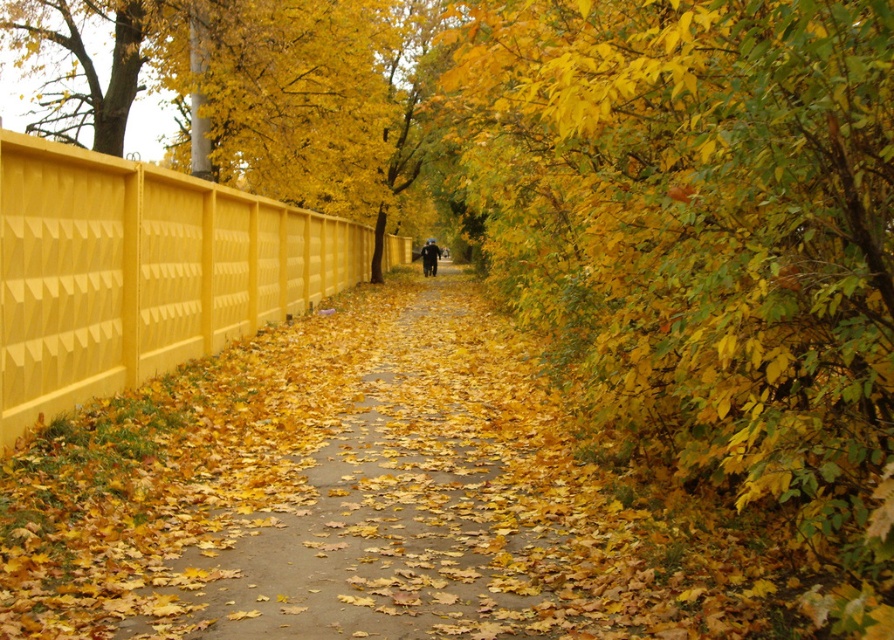
You are standing on the yellow concrete pavement at center and want to see over the matte yellow fence at left to check the weather. Can you see over the fence from your current position?

The yellow concrete pavement at center has a lesser height compared to matte yellow fence at left, so you cannot see over the matte yellow fence at left from your current position.

Consider the image. You are standing on the pathway in the autumn scene. You see a matte yellow fence at left and a dark blue jacket at center. Which object is closer to the ground?

The matte yellow fence at left is closer to the ground because it is positioned below the dark blue jacket at center.